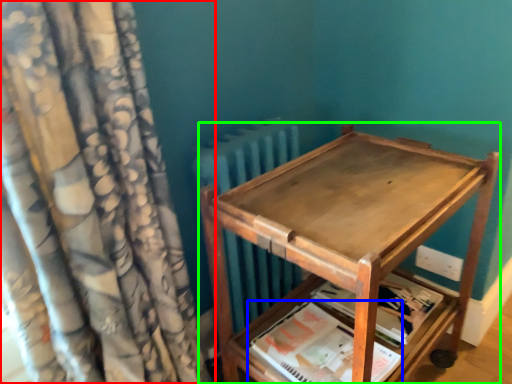
Question: Which object is the farthest from curtain (highlighted by a red box)? Choose among these: paperback book (highlighted by a blue box) or furniture (highlighted by a green box).

Choices:
 (A) paperback book
 (B) furniture

Answer: (A)